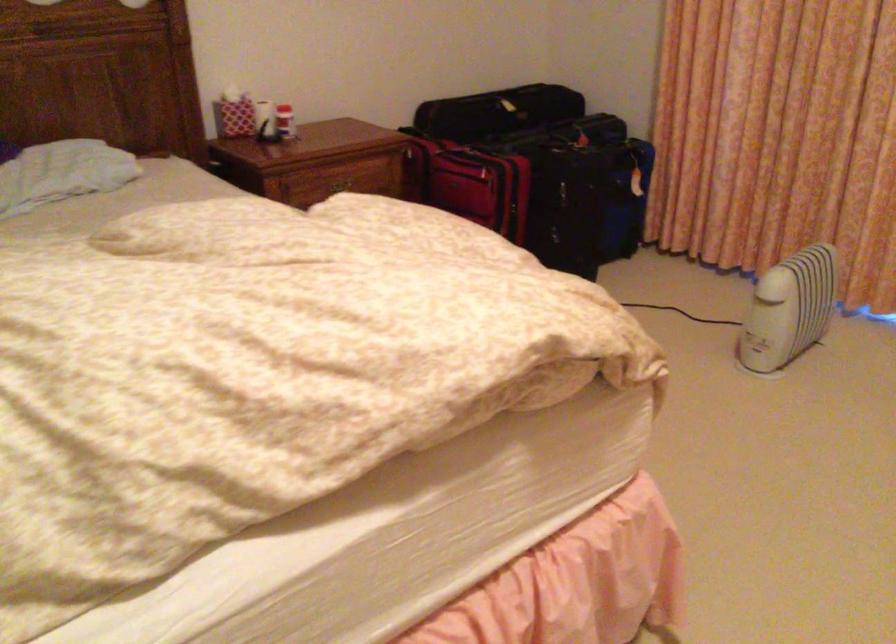
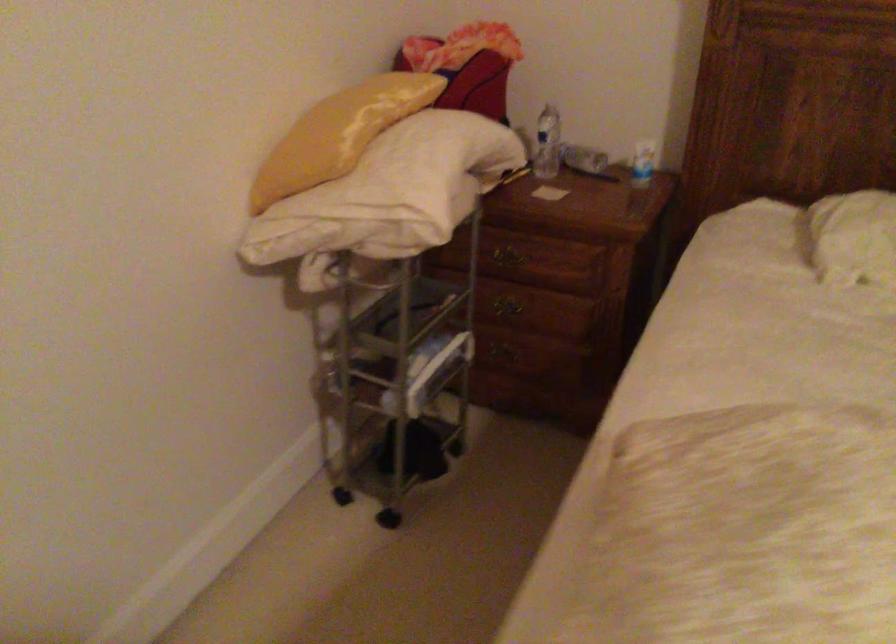
First-person continuous shooting, in which direction is the camera rotating?

The camera's rotation is toward left-down.